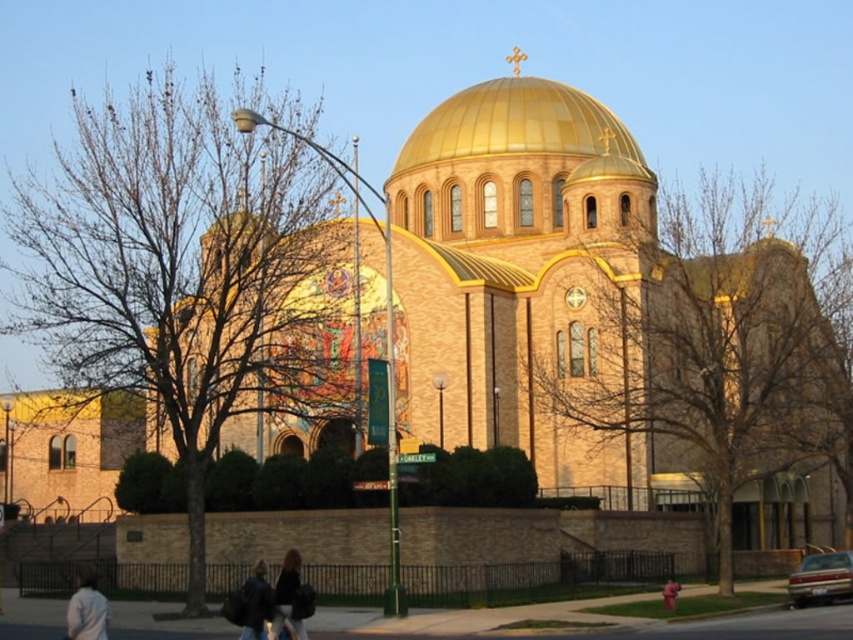
Question: Which point is farther to the camera?

Choices:
 (A) dark blue jacket at lower center
 (B) light gray jacket at lower left
 (C) gold polished dome at upper center
 (D) dark brown leather jacket at lower center

Answer: (C)

Question: Is dark brown leather jacket at lower center smaller than dark blue jacket at lower center?

Choices:
 (A) no
 (B) yes

Answer: (A)

Question: Which of the following is the closest to the observer?

Choices:
 (A) (570, 131)
 (B) (80, 609)
 (C) (247, 580)

Answer: (B)

Question: Does light gray jacket at lower left appear on the left side of dark blue jacket at lower center?

Choices:
 (A) no
 (B) yes

Answer: (B)

Question: Is gold polished dome at upper center closer to the viewer compared to metallic silver sedan at lower right?

Choices:
 (A) yes
 (B) no

Answer: (B)

Question: Which of the following is the farthest from the observer?

Choices:
 (A) (254, 588)
 (B) (97, 600)
 (C) (398, 157)
 (D) (289, 556)

Answer: (C)